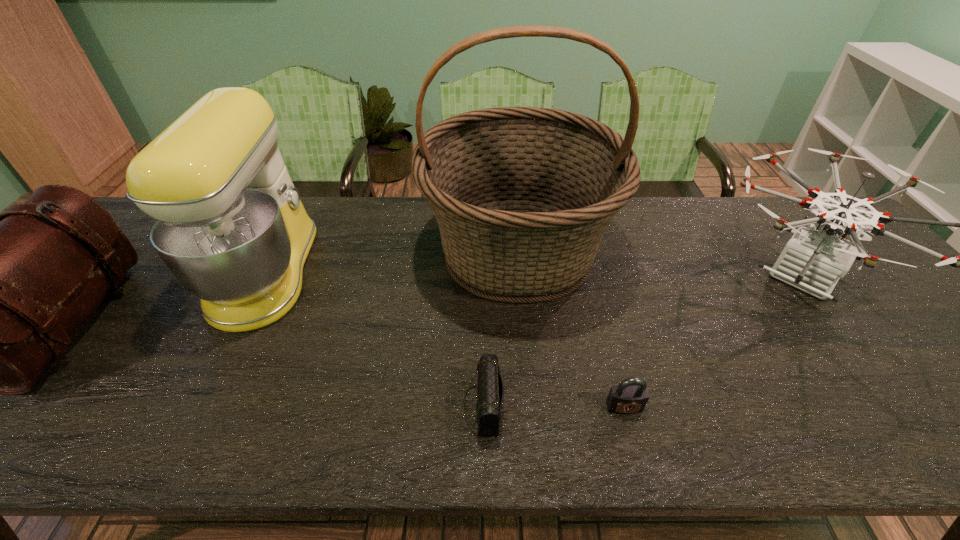
Find the location of `vacant area situated on the front flap of the clutch bag`. vacant area situated on the front flap of the clutch bag is located at coordinates (304, 406).

The image size is (960, 540). Find the location of `vacant space situated on the front flap of the clutch bag`. vacant space situated on the front flap of the clutch bag is located at coordinates (367, 406).

You are a GUI agent. You are given a task and a screenshot of the screen. Output one action in this format:
    pyautogui.click(x=<x>, y=<y>)
    Task: Click on the free space located 0.260m on the front flap of the clutch bag
    Image resolution: width=960 pixels, height=540 pixels.
    Given the screenshot: What is the action you would take?
    pyautogui.click(x=338, y=406)

Locate an element on the screen. The width and height of the screenshot is (960, 540). basket situated at the far edge is located at coordinates (522, 195).

This screenshot has width=960, height=540. I want to click on mixer located at the far edge, so click(231, 228).

Locate an element on the screen. This screenshot has width=960, height=540. drone that is at the far edge is located at coordinates (813, 260).

In order to click on padlock that is at the near edge in this screenshot , I will do `click(631, 395)`.

You are a GUI agent. You are given a task and a screenshot of the screen. Output one action in this format:
    pyautogui.click(x=<x>, y=<y>)
    Task: Click on the clutch bag located in the near edge section of the desktop
    The height and width of the screenshot is (540, 960).
    Given the screenshot: What is the action you would take?
    pyautogui.click(x=490, y=394)

Identify the location of object at the right edge. Image resolution: width=960 pixels, height=540 pixels. (813, 260).

Identify the location of object at the far right corner. (813, 260).